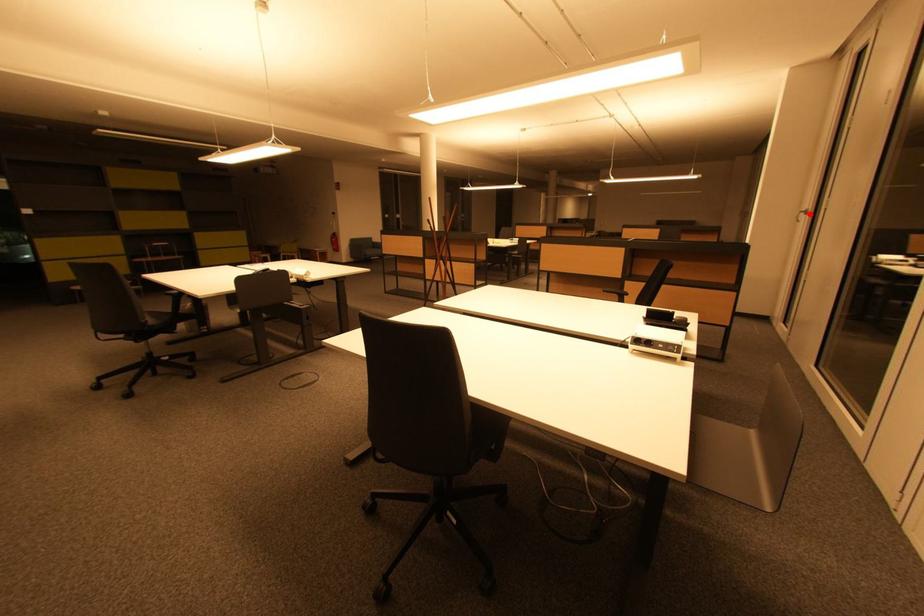
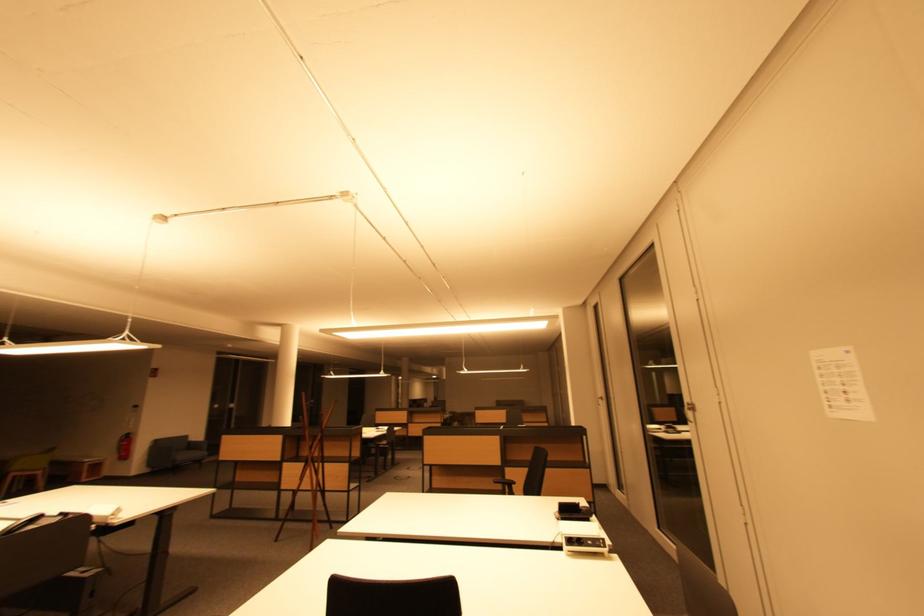
The point at the highlighted location is marked in the first image. Where is the corresponding point in the second image?

(605, 400)